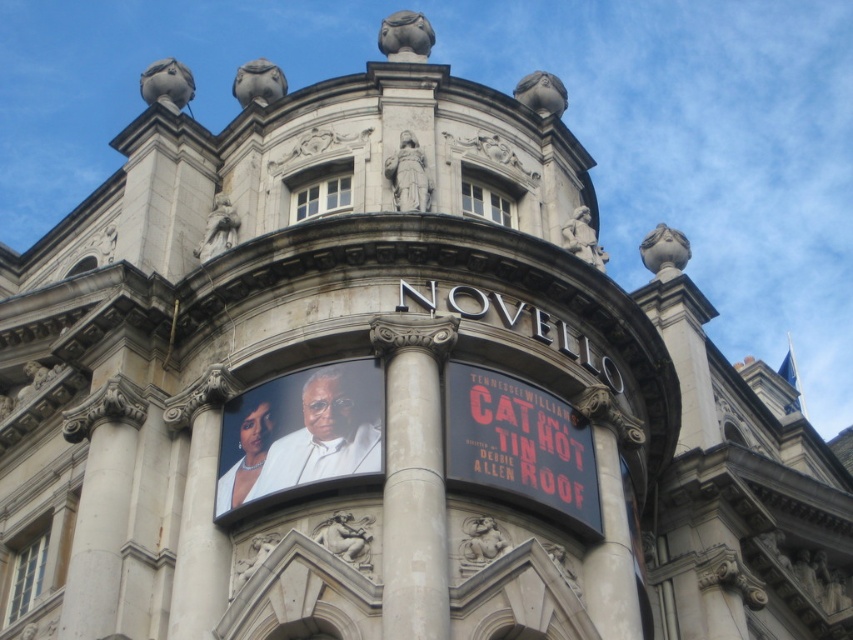
Question: Which is nearer to the white stone column at center?

Choices:
 (A) black matte sign at center
 (B) white stone pillar at center

Answer: (A)

Question: Can you confirm if white stone column at center is thinner than white stone pillar at center?

Choices:
 (A) no
 (B) yes

Answer: (A)

Question: Where is white stone column at center located in relation to black matte sign at center in the image?

Choices:
 (A) above
 (B) below

Answer: (B)

Question: Among these objects, which one is nearest to the camera?

Choices:
 (A) white stone pillar at center
 (B) black matte sign at center

Answer: (A)

Question: Which of these objects is positioned closest to the white stone pillar at center?

Choices:
 (A) black matte sign at center
 (B) white stone column at center

Answer: (A)

Question: Does white stone column at center appear over white stone pillar at center?

Choices:
 (A) yes
 (B) no

Answer: (A)